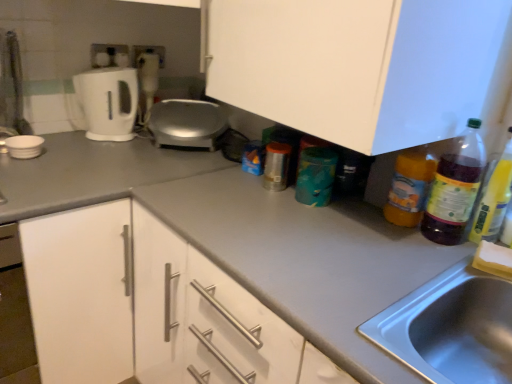
Find the location of a particular element. This screenshot has height=384, width=512. free location in front of white glossy electric kettle at upper left is located at coordinates (89, 147).